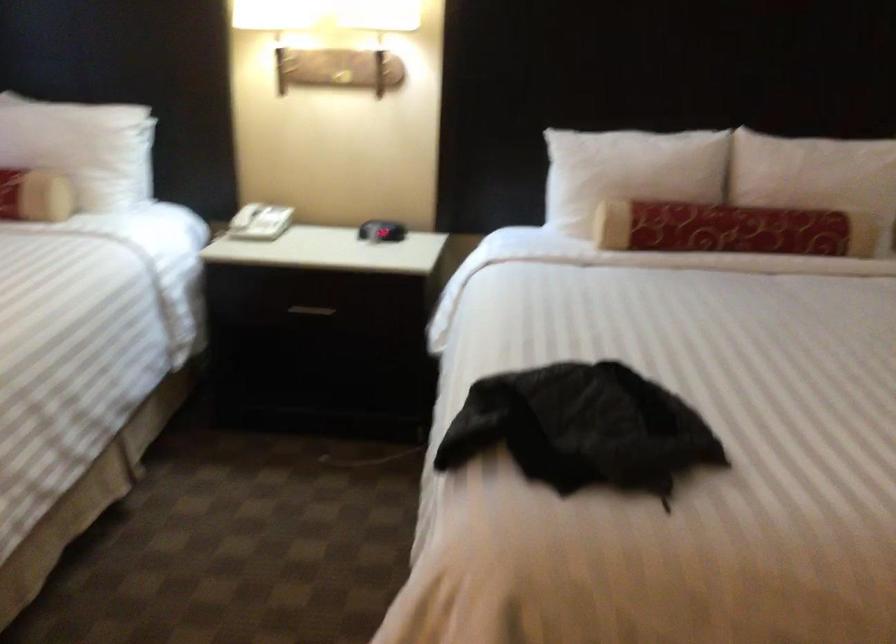
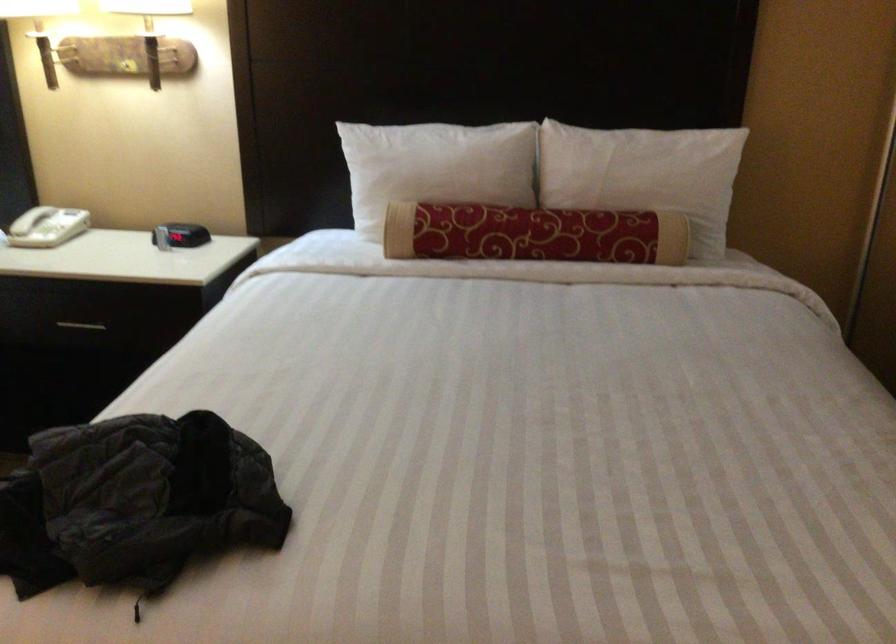
In the second image, find the point that corresponds to the point at 744,223 in the first image.

(533, 234)